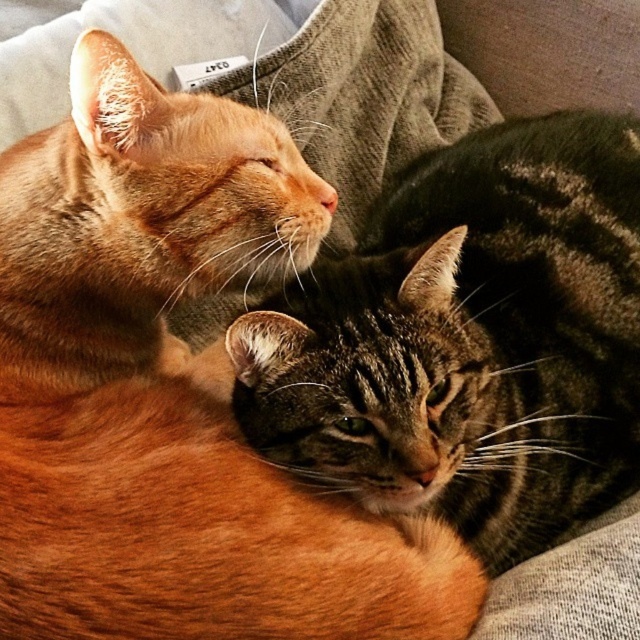
You are a photographer aiming to capture the cats without any obstructions. You notice two points in the image at coordinates point (260,509) and point (342,461). Which point should you focus on to ensure the cat in front is sharp?

Point (260,509) is in front of point (342,461). Therefore, focusing on point (260,509) will ensure the cat in front is sharp.

You are a photographer trying to capture both cats in a single frame. Given that the orange fur cat at upper left is smaller than the tabby fur cat at center, which cat should you focus on to ensure both are in the frame without cropping?

You should focus on the tabby fur cat at center because it is larger than the orange fur cat at upper left, ensuring both will fit within the frame without cropping.

You are a photographer trying to capture a clear photo of the tabby fur cat at center. However, the orange fur cat at upper left is blocking your view. Can you adjust your position to take the photo without moving the cats?

The orange fur cat at upper left is in front of the tabby fur cat at center, so you can move to the side to get around the orange fur cat at upper left and take a clear photo of the tabby fur cat at center.